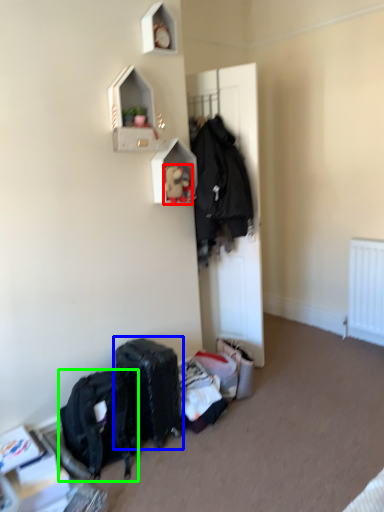
Question: Based on their relative distances, which object is nearer to toy (highlighted by a red box)? Choose from luggage and bags (highlighted by a blue box) and backpack (highlighted by a green box).

Choices:
 (A) luggage and bags
 (B) backpack

Answer: (A)